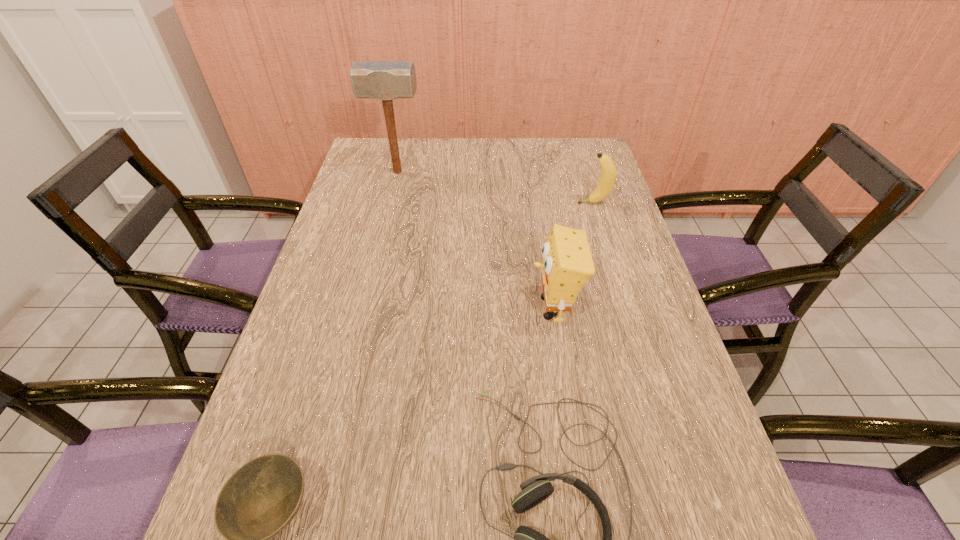
The height and width of the screenshot is (540, 960). Identify the location of the farthest object. (385, 80).

At what (x,y) coordinates should I click in order to perform the action: click on the tallest object. Please return your answer as a coordinate pair (x, y). The width and height of the screenshot is (960, 540). Looking at the image, I should click on 385,80.

Where is `the third farthest object`? the third farthest object is located at coordinates (567, 265).

You are a GUI agent. You are given a task and a screenshot of the screen. Output one action in this format:
    pyautogui.click(x=<x>, y=<y>)
    Task: Click on the second tallest object
    Image resolution: width=960 pixels, height=540 pixels.
    Given the screenshot: What is the action you would take?
    pyautogui.click(x=567, y=265)

Where is `the second farthest object`? the second farthest object is located at coordinates (608, 169).

At what (x,y) coordinates should I click in order to perform the action: click on the rightmost object. Please return your answer as a coordinate pair (x, y). The image size is (960, 540). Looking at the image, I should click on (608, 169).

The image size is (960, 540). I want to click on free space located 0.310m on the striking face of the tallest object, so click(x=515, y=172).

Find the location of a particular element. This screenshot has width=960, height=540. free space located 0.220m on the face of the third farthest object is located at coordinates (439, 308).

Find the location of a particular element. This screenshot has width=960, height=540. free space located 0.200m on the face of the third farthest object is located at coordinates (447, 308).

Where is `vacant space located on the face of the third farthest object`? This screenshot has width=960, height=540. vacant space located on the face of the third farthest object is located at coordinates (484, 308).